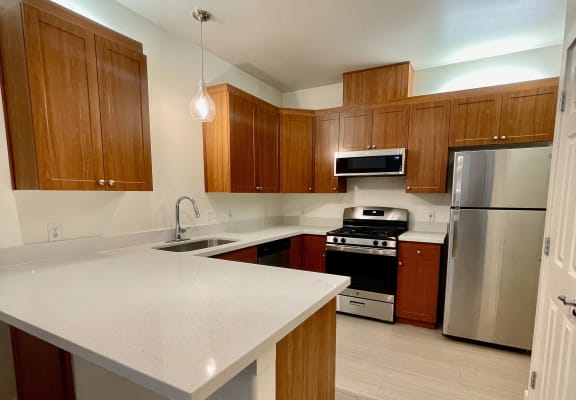
Find the location of a particular element. countertop is located at coordinates 191,326.